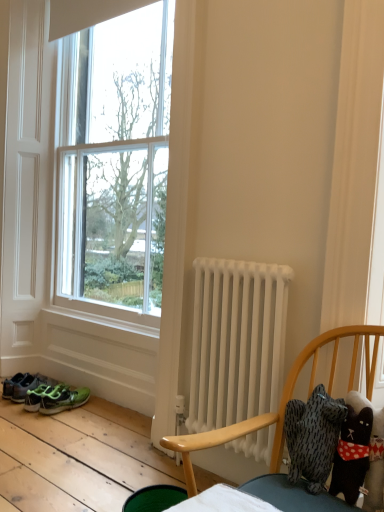
Question: Is white fabric curtain at right positioned before white matte radiator at center?

Choices:
 (A) no
 (B) yes

Answer: (B)

Question: Is white fabric curtain at right smaller than white matte radiator at center?

Choices:
 (A) yes
 (B) no

Answer: (A)

Question: Is white fabric curtain at right positioned with its back to white matte radiator at center?

Choices:
 (A) yes
 (B) no

Answer: (B)

Question: From a real-world perspective, does white fabric curtain at right stand above white matte radiator at center?

Choices:
 (A) yes
 (B) no

Answer: (A)

Question: Is white fabric curtain at right thinner than white matte radiator at center?

Choices:
 (A) yes
 (B) no

Answer: (A)

Question: From the image's perspective, is green matte sneakers at lower left, arranged as the second footwear when viewed from the left, above or below white matte radiator at center?

Choices:
 (A) above
 (B) below

Answer: (B)

Question: In terms of width, does green matte sneakers at lower left, the first footwear viewed from the right, look wider or thinner when compared to white matte radiator at center?

Choices:
 (A) thin
 (B) wide

Answer: (B)

Question: Based on their sizes in the image, would you say green matte sneakers at lower left, the first footwear viewed from the right, is bigger or smaller than white matte radiator at center?

Choices:
 (A) big
 (B) small

Answer: (B)

Question: In the image, is green matte sneakers at lower left, the first footwear viewed from the right, positioned in front of or behind white matte radiator at center?

Choices:
 (A) front
 (B) behind

Answer: (B)

Question: Considering their positions, is white fabric curtain at right located in front of or behind green mesh sneakers at lower left, acting as the 1th footwear starting from the left?

Choices:
 (A) behind
 (B) front

Answer: (B)

Question: From the image's perspective, is white fabric curtain at right located above or below green mesh sneakers at lower left, acting as the 1th footwear starting from the left?

Choices:
 (A) above
 (B) below

Answer: (A)

Question: Considering the positions of point (339, 125) and point (82, 393), is point (339, 125) closer or farther from the camera than point (82, 393)?

Choices:
 (A) farther
 (B) closer

Answer: (B)

Question: Which is correct: white fabric curtain at right is inside green mesh sneakers at lower left, acting as the 1th footwear starting from the left, or outside of it?

Choices:
 (A) outside
 (B) inside

Answer: (A)

Question: Based on their positions, is green matte sneakers at lower left, the first footwear viewed from the right, located to the left or right of white fabric curtain at right?

Choices:
 (A) left
 (B) right

Answer: (A)

Question: Do you think green matte sneakers at lower left, arranged as the second footwear when viewed from the left, is within white fabric curtain at right, or outside of it?

Choices:
 (A) inside
 (B) outside

Answer: (B)